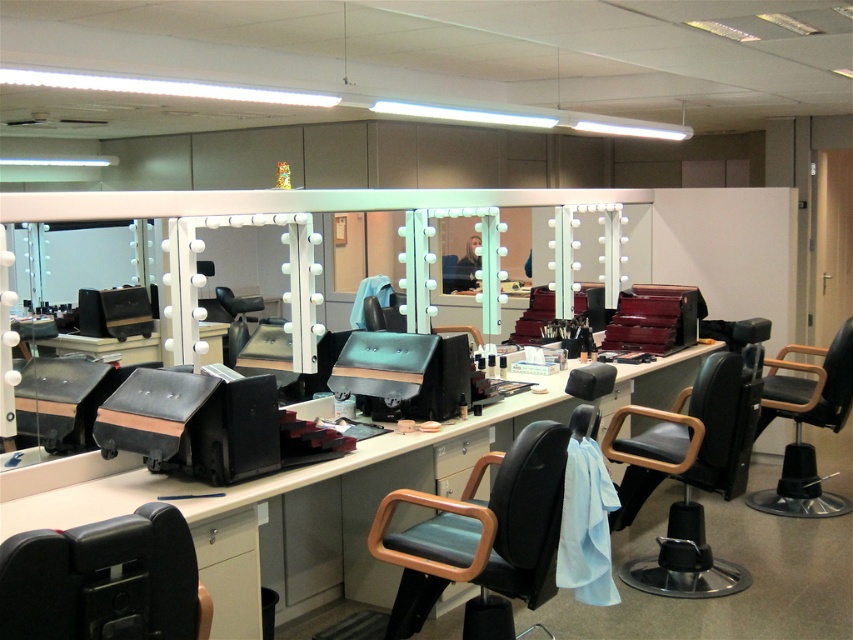
Looking at this image, does black matte swivel chair at center come behind matte black barber chair at center?

That is False.

Is point (126, 544) positioned after point (469, 243)?

No, (126, 544) is in front of (469, 243).

This screenshot has height=640, width=853. I want to click on black matte swivel chair at center, so click(103, 580).

Is the position of black leather chair at center less distant than that of black leather chair at lower right?

Yes, it is.

Is black leather chair at center taller than black leather chair at lower right?

Yes.

This screenshot has height=640, width=853. Identify the location of black leather chair at center. (689, 474).

The image size is (853, 640). Describe the element at coordinates (103, 580) in the screenshot. I see `black matte swivel chair at center` at that location.

Which is below, black matte swivel chair at center or matte black swivel chair at center?

matte black swivel chair at center

At what (x,y) coordinates should I click in order to perform the action: click on black matte swivel chair at center. Please return your answer as a coordinate pair (x, y). Looking at the image, I should click on (103, 580).

Find the location of a particular element. The image size is (853, 640). black matte swivel chair at center is located at coordinates (103, 580).